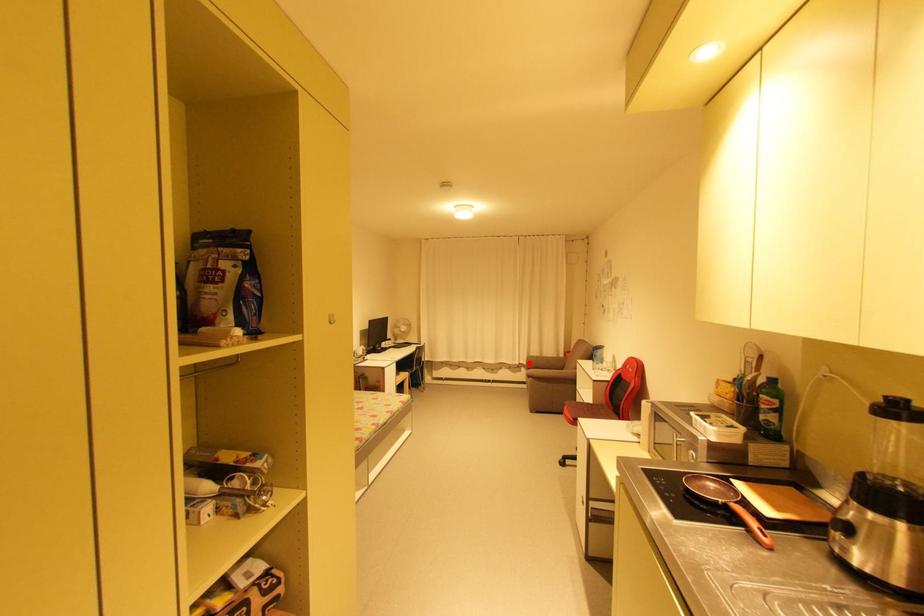
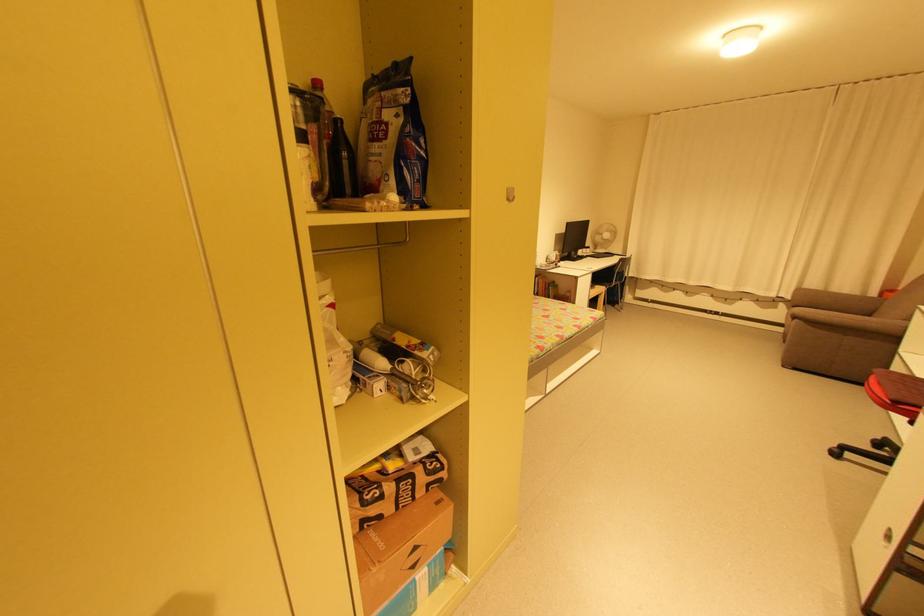
Where in the second image is the point corresponding to the highlighted location from the first image?

(794, 297)